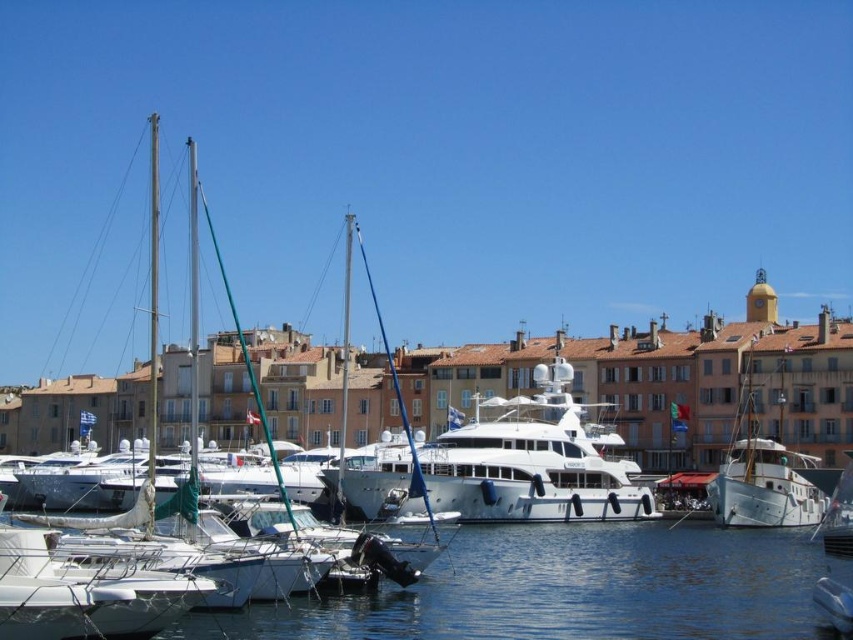
You are a dock worker who needs to move a 10 feet wide cargo container between the white glossy yacht at center and the white wooden sailboat at right. Can you fit the container between them without touching either boat?

The distance between the white glossy yacht at center and the white wooden sailboat at right is 50.84 feet. Since the cargo container is only 10 feet wide, there is ample space to fit it between them without any contact.

You are a dock worker assessing the height of the boats for a new crane installation. The crane requires knowing which boat is taller. Which one is taller between the white glossy yacht at center and the white glossy sailboat at left?

The white glossy sailboat at left is taller than the white glossy yacht at center.

You are standing at the edge of the marina looking out at the boats. If you were to draw a straight line from your position to the point labeled point (x=415, y=513) and another line to point (x=763, y=337), which point would require a shorter line?

Point (x=415, y=513) is closer to the viewer than point (x=763, y=337), so the line to point (x=415, y=513) would be shorter.